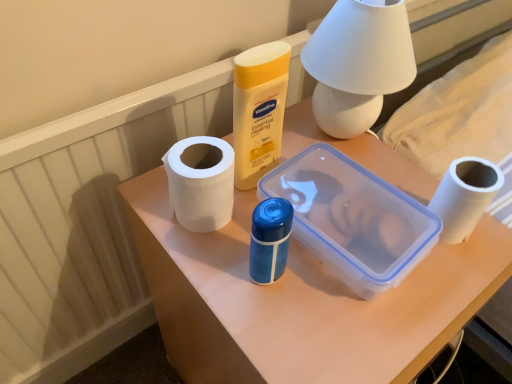
The height and width of the screenshot is (384, 512). I want to click on unoccupied area behind white matte toilet paper at right, so click(x=378, y=162).